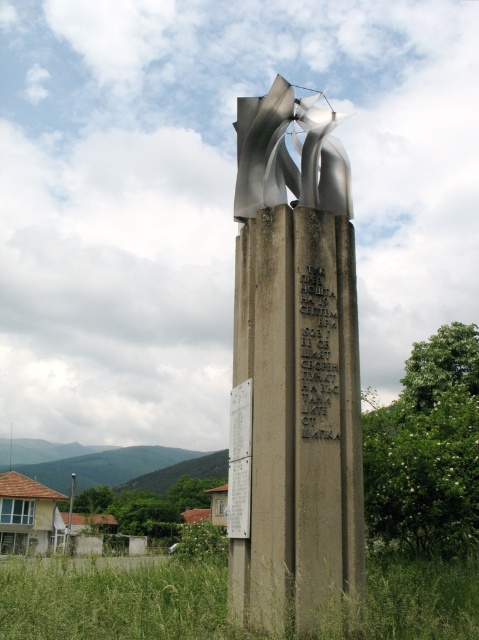
Question: Can you confirm if shiny metallic sculpture at center is wider than black stone inscription at center?

Choices:
 (A) yes
 (B) no

Answer: (A)

Question: Which of these objects is positioned closest to the white paper at center?

Choices:
 (A) black stone inscription at center
 (B) metallic silver sculpture at center
 (C) shiny metallic sculpture at center

Answer: (A)

Question: Where is shiny metallic sculpture at center located in relation to white paper at center in the image?

Choices:
 (A) below
 (B) above

Answer: (B)

Question: Is metallic silver sculpture at center to the right of white paper at center from the viewer's perspective?

Choices:
 (A) yes
 (B) no

Answer: (A)

Question: Among these objects, which one is nearest to the camera?

Choices:
 (A) metallic silver sculpture at center
 (B) black stone inscription at center

Answer: (A)

Question: Which object appears closest to the camera in this image?

Choices:
 (A) metallic silver sculpture at center
 (B) black stone inscription at center
 (C) white paper at center
 (D) shiny metallic sculpture at center

Answer: (A)